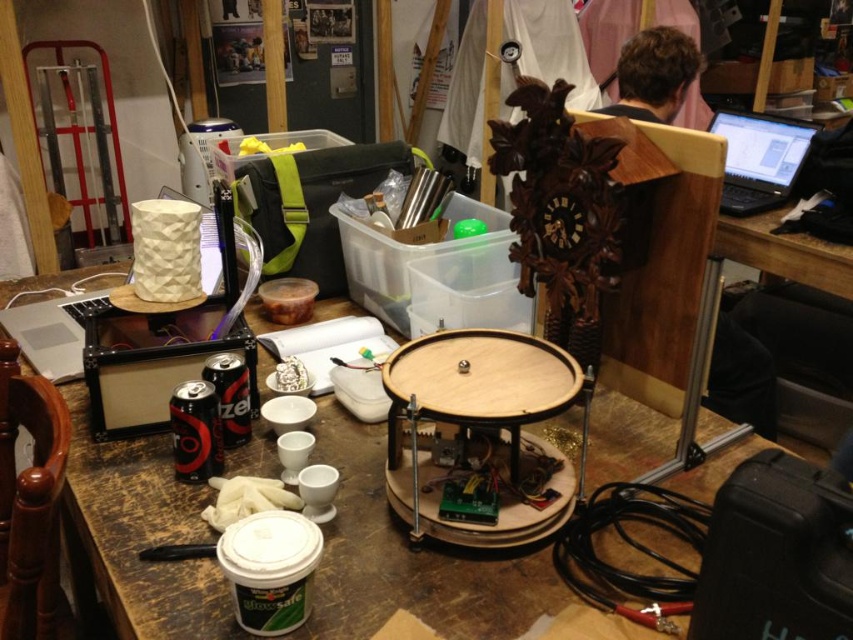
Question: Does wooden table at center appear on the right side of wooden round table at center?

Choices:
 (A) yes
 (B) no

Answer: (B)

Question: Does wooden table at center have a greater width compared to brown hair at upper right?

Choices:
 (A) no
 (B) yes

Answer: (B)

Question: Which point is closer to the camera?

Choices:
 (A) (737, 196)
 (B) (639, 32)

Answer: (A)

Question: Can you confirm if black plastic laptop at upper right is smaller than brown hair at upper right?

Choices:
 (A) yes
 (B) no

Answer: (B)

Question: Which object is closer to the camera taking this photo?

Choices:
 (A) wooden table at center
 (B) black plastic laptop at upper right

Answer: (A)

Question: Estimate the real-world distances between objects in this image. Which object is closer to the black plastic laptop at upper right?

Choices:
 (A) brown hair at upper right
 (B) wooden round table at center
 (C) wooden table at center

Answer: (A)